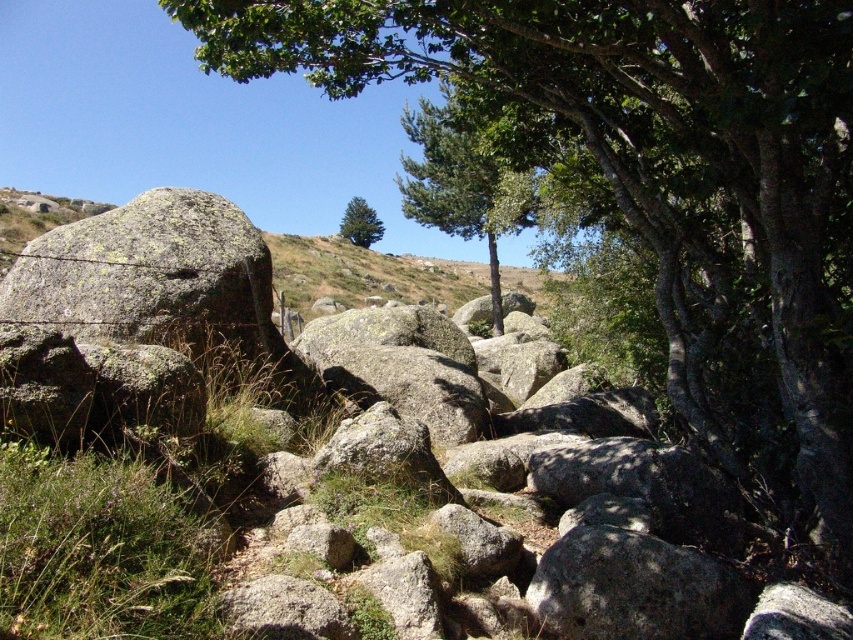
Question: Which of these objects is positioned closest to the green leafy tree at upper center?

Choices:
 (A) gray rough rock at center
 (B) green leafy tree at center
 (C) gray rough rock at center-left

Answer: (A)

Question: Does green leafy tree at upper center have a lesser width compared to green textured tree at center?

Choices:
 (A) yes
 (B) no

Answer: (B)

Question: Estimate the real-world distances between objects in this image. Which object is farther from the gray rough rock at center?

Choices:
 (A) green leafy tree at center
 (B) gray rough rock at center-left
 (C) green textured tree at center

Answer: (C)

Question: Based on their relative distances, which object is nearer to the green leafy tree at center?

Choices:
 (A) gray rough rock at center-left
 (B) green leafy tree at upper center
 (C) green textured tree at center

Answer: (B)

Question: Can you confirm if green leafy tree at center is thinner than green textured tree at center?

Choices:
 (A) no
 (B) yes

Answer: (A)

Question: Does gray rough rock at center have a smaller size compared to green textured tree at center?

Choices:
 (A) no
 (B) yes

Answer: (B)